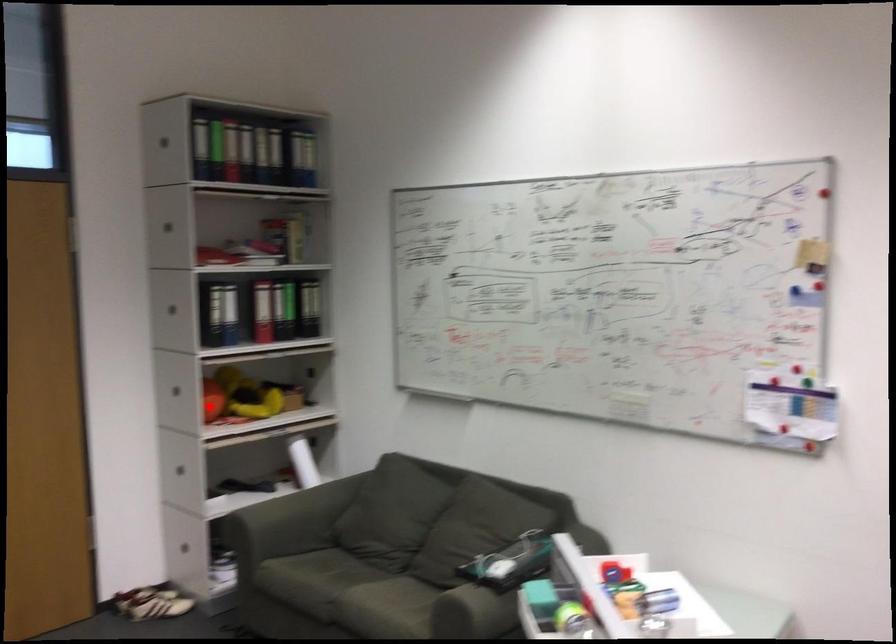
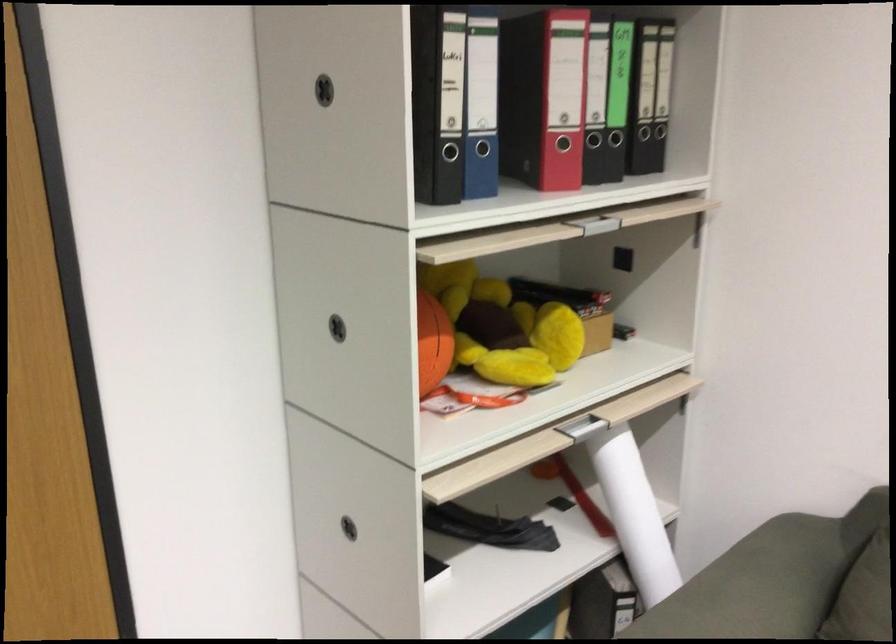
Question: I am providing you with two images of the same scene from different viewpoints. In image1, a red point is highlighted. Considering the same 3D point in image2, which of the following is correct?

Choices:
 (A) It is closer
 (B) It is farther

Answer: (A)